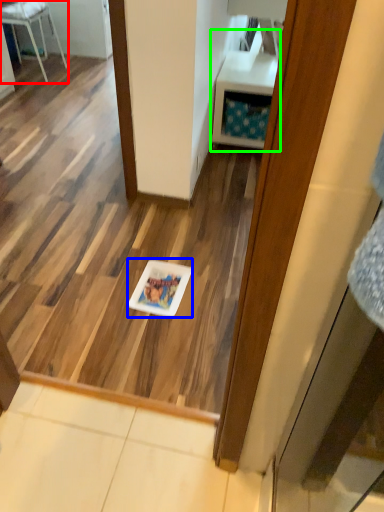
Question: Considering the real-world distances, which object is farthest from furniture (highlighted by a red box)? glass plate (highlighted by a blue box) or vanity (highlighted by a green box)?

Choices:
 (A) glass plate
 (B) vanity

Answer: (A)